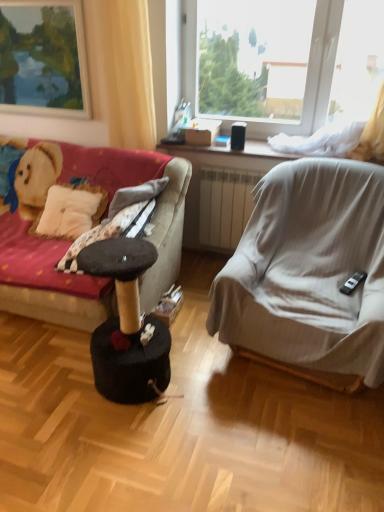
The image size is (384, 512). Find the location of `free space in front of light gray fabric chair at right`. free space in front of light gray fabric chair at right is located at coordinates (276, 445).